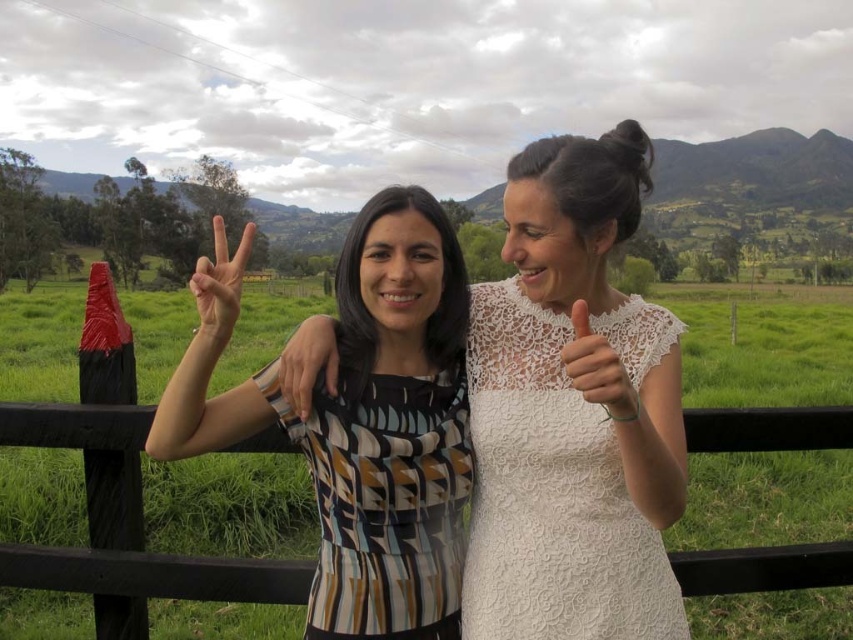
Question: Which point is farther from the camera taking this photo?

Choices:
 (A) (229, 276)
 (B) (311, 380)
 (C) (561, 515)

Answer: (B)

Question: Which of the following is the closest to the observer?

Choices:
 (A) (407, 637)
 (B) (225, 273)
 (C) (288, 376)

Answer: (B)

Question: Does matte black hand at center appear on the left side of white lace hand at center?

Choices:
 (A) no
 (B) yes

Answer: (B)

Question: Is white lace hand at center positioned in front of matte black dress at center?

Choices:
 (A) no
 (B) yes

Answer: (B)

Question: Is patterned fabric dress at center bigger than white lace hand at center?

Choices:
 (A) yes
 (B) no

Answer: (A)

Question: Among these objects, which one is nearest to the camera?

Choices:
 (A) matte black hand at center
 (B) patterned fabric dress at center
 (C) matte black dress at center
 (D) white lace dress at center

Answer: (D)